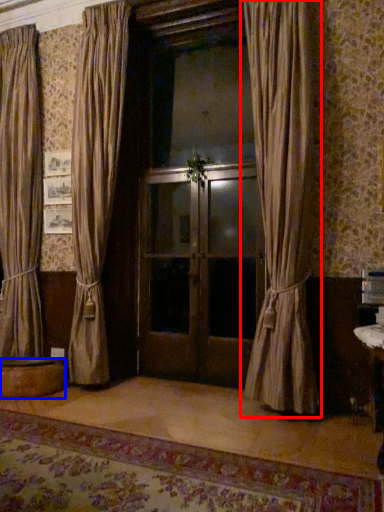
Question: Which point is further to the camera, curtain (highlighted by a red box) or round table (highlighted by a blue box)?

Choices:
 (A) curtain
 (B) round table

Answer: (B)